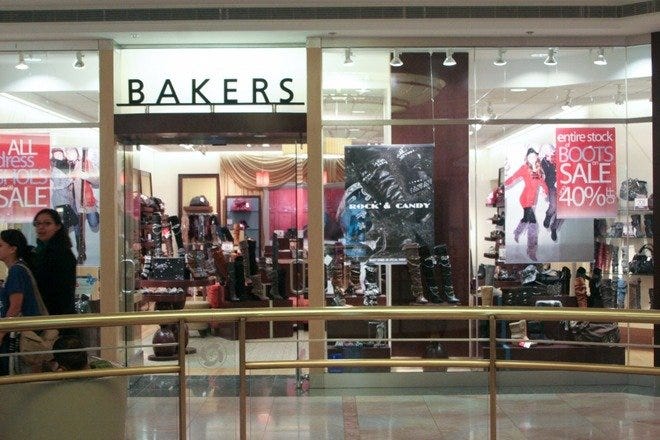
Find the location of a particular element. The height and width of the screenshot is (440, 660). entry is located at coordinates 244,181.